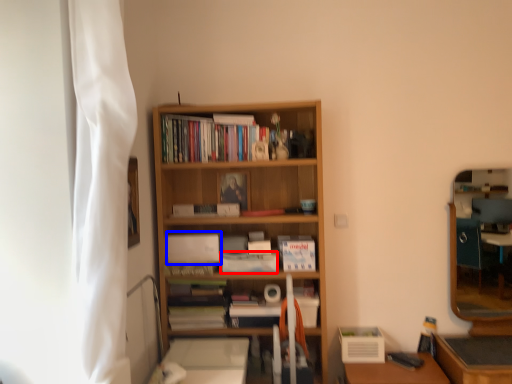
Question: Which point is closer to the camera, paperback book (highlighted by a red box) or paperback book (highlighted by a blue box)?

Choices:
 (A) paperback book
 (B) paperback book

Answer: (A)